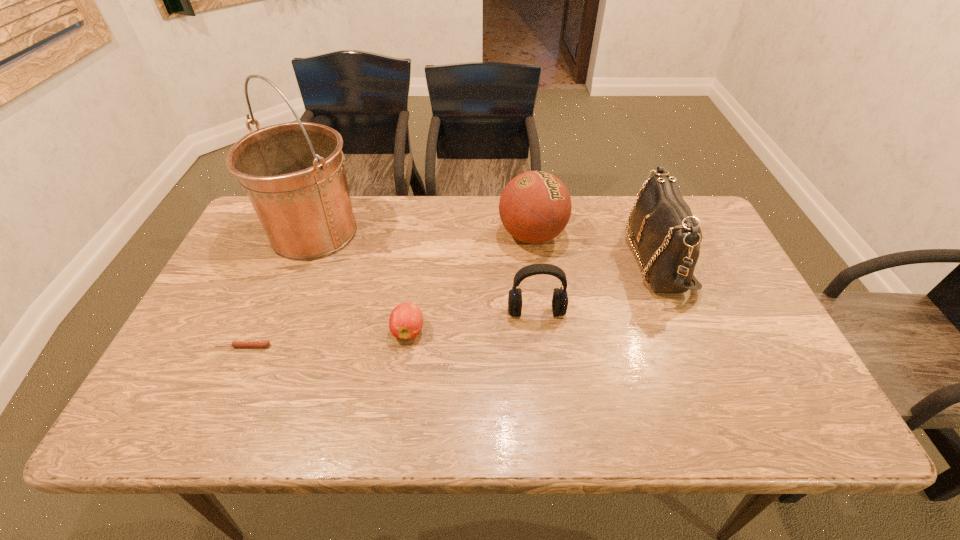
Identify the location of bucket. The height and width of the screenshot is (540, 960). (294, 174).

In order to click on handbag in this screenshot , I will do [x=667, y=235].

Identify the location of basketball. This screenshot has width=960, height=540. (535, 207).

You are a GUI agent. You are given a task and a screenshot of the screen. Output one action in this format:
    pyautogui.click(x=<x>, y=<y>)
    Task: Click on the headset
    
    Given the screenshot: What is the action you would take?
    pyautogui.click(x=560, y=298)

Locate an element on the screen. This screenshot has height=540, width=960. the second shortest object is located at coordinates (406, 320).

The width and height of the screenshot is (960, 540). I want to click on apple, so click(x=406, y=320).

Find the location of `the shortest object`. the shortest object is located at coordinates (237, 343).

The width and height of the screenshot is (960, 540). Find the location of `vacant space positioned 0.130m on the right of the tallest object`. vacant space positioned 0.130m on the right of the tallest object is located at coordinates (404, 232).

Image resolution: width=960 pixels, height=540 pixels. I want to click on vacant area situated 0.330m at the front of the handbag with chain and zipper, so click(x=516, y=258).

The width and height of the screenshot is (960, 540). I want to click on vacant area situated at the front of the handbag with chain and zipper, so click(x=598, y=258).